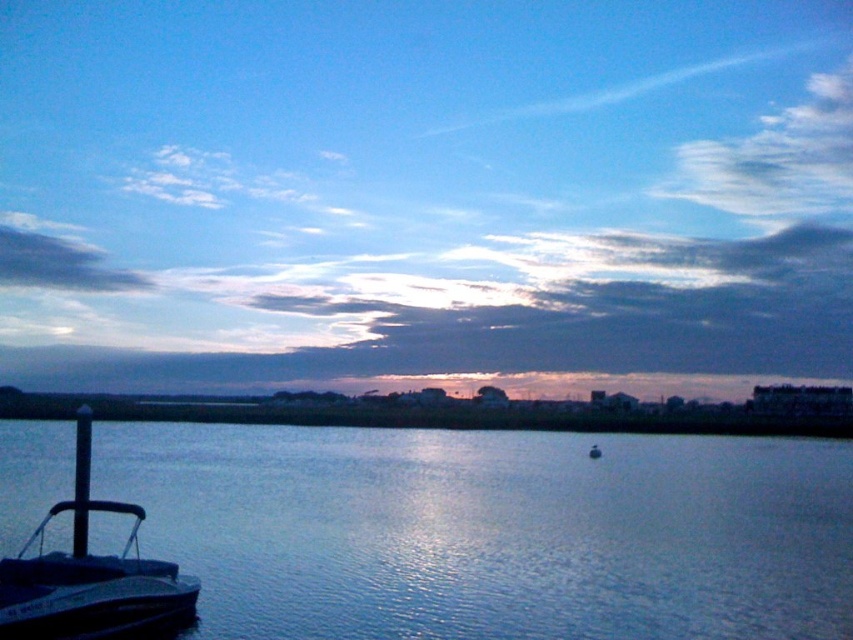
Can you confirm if blue water at lower left is positioned to the left of metallic gray boat at lower left?

No, blue water at lower left is not to the left of metallic gray boat at lower left.

Looking at this image, does blue water at lower left have a smaller size compared to metallic gray boat at lower left?

No, blue water at lower left is not smaller than metallic gray boat at lower left.

Who is more distant from viewer, (405, 612) or (83, 632)?

The point (405, 612) is behind.

Find the location of a particular element. This screenshot has height=640, width=853. blue water at lower left is located at coordinates [491, 531].